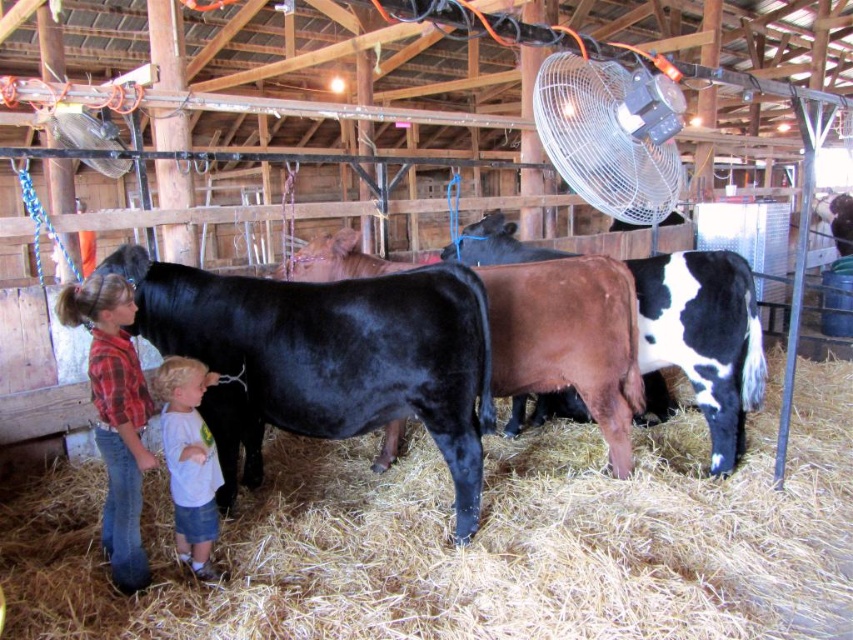
Question: Considering the relative positions of metallic silver fan at upper center and denim jeans at lower left in the image provided, where is metallic silver fan at upper center located with respect to denim jeans at lower left?

Choices:
 (A) right
 (B) left

Answer: (A)

Question: Which point is farther to the camera?

Choices:
 (A) (616, 104)
 (B) (692, 278)

Answer: (B)

Question: Where is black smooth bull at center located in relation to black smooth cow at center in the image?

Choices:
 (A) below
 (B) above

Answer: (A)

Question: Considering the real-world distances, which object is farthest from the denim jeans at lower left?

Choices:
 (A) metallic silver fan at upper center
 (B) white cotton shirt at lower left
 (C) black smooth cow at center

Answer: (A)

Question: Considering the real-world distances, which object is farthest from the white cotton shirt at lower left?

Choices:
 (A) brown smooth cow at center
 (B) denim jeans at lower left
 (C) black smooth cow at center

Answer: (A)

Question: Does black smooth bull at center come in front of brown smooth cow at center?

Choices:
 (A) yes
 (B) no

Answer: (A)